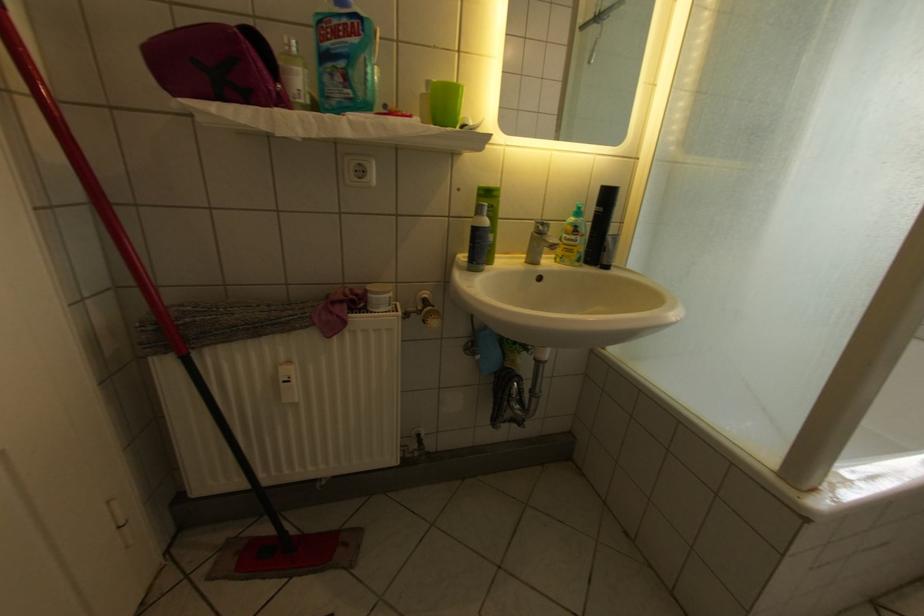
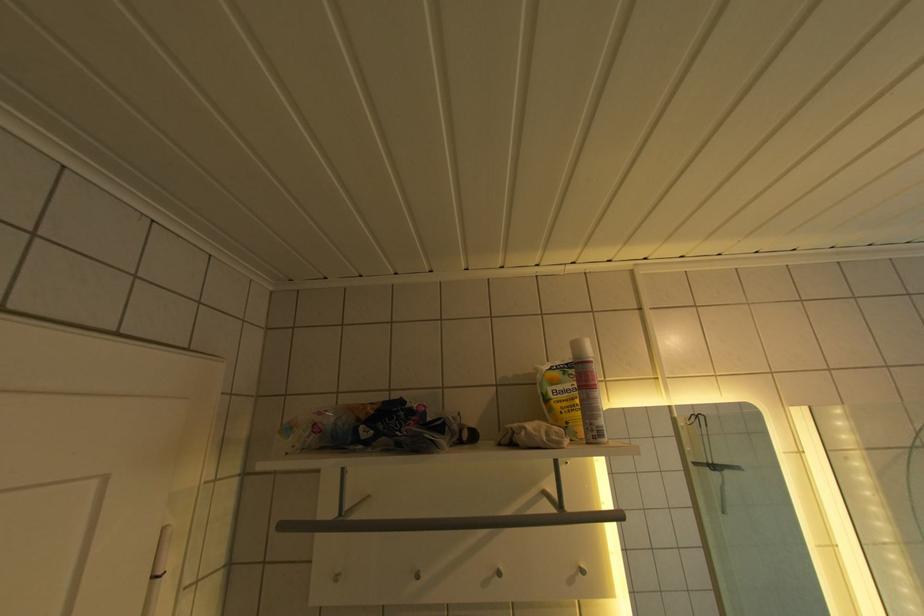
The first image is from the beginning of the video and the second image is from the end. How did the camera likely rotate when shooting the video?

The rotation direction of the camera is left-up.